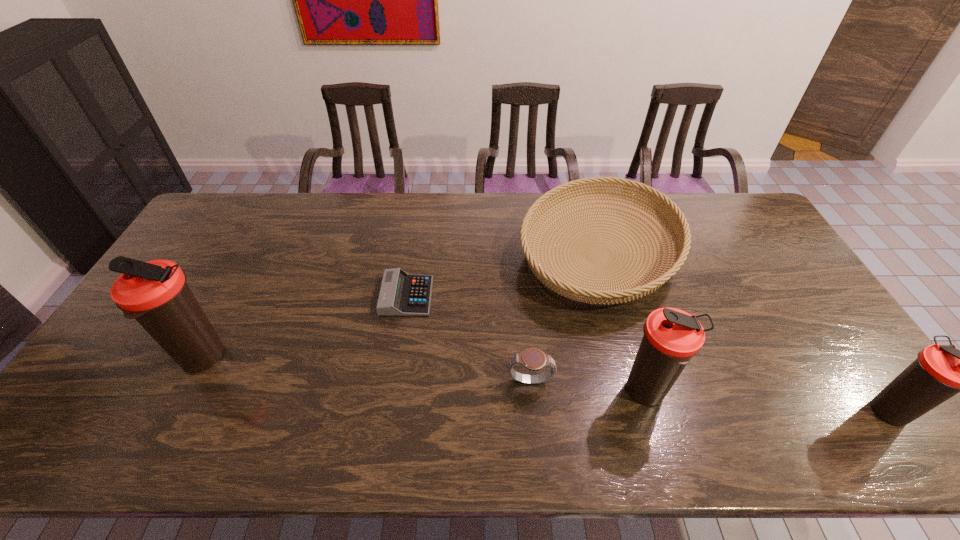
Please point a location where one more thermos_bottle can be added evenly. Please provide its 2D coordinates. Your answer should be formatted as a tuple, i.e. [(x, y)], where the tuple contains the x and y coordinates of a point satisfying the conditions above.

[(419, 375)]